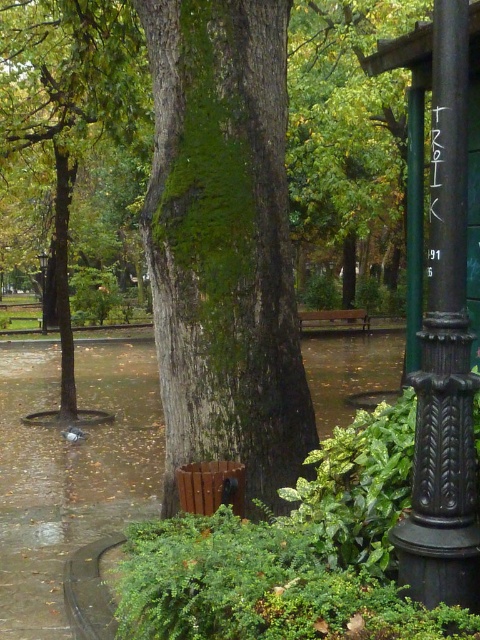
From the picture: You are a park visitor trying to find a place to sit while avoiding the rain. You see the black cast iron pole at right and the brown wooden bench at center. Which object is larger and more suitable for sitting?

The brown wooden bench at center is larger than the black cast iron pole at right, making it more suitable for sitting.

You are a park visitor holding an umbrella. You see the black cast iron pole at right and the brown wooden bench at center. Where is the pole located in relation to the bench?

The black cast iron pole at right is positioned under the brown wooden bench at center.

You are standing at the center of the park and see the point marked at coordinates (414,227). What object is located at that point?

The point at coordinates (414,227) corresponds to the green polished metal pole at right.